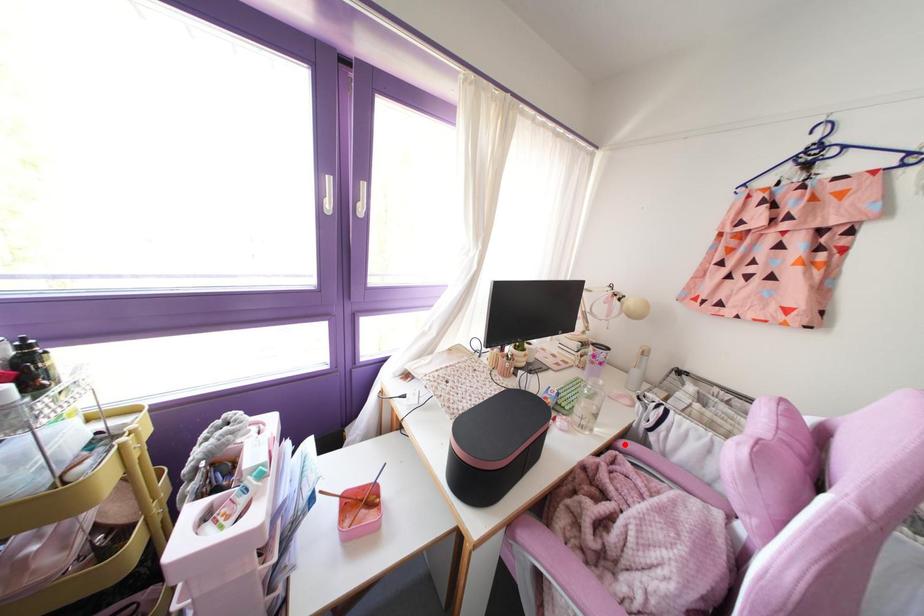
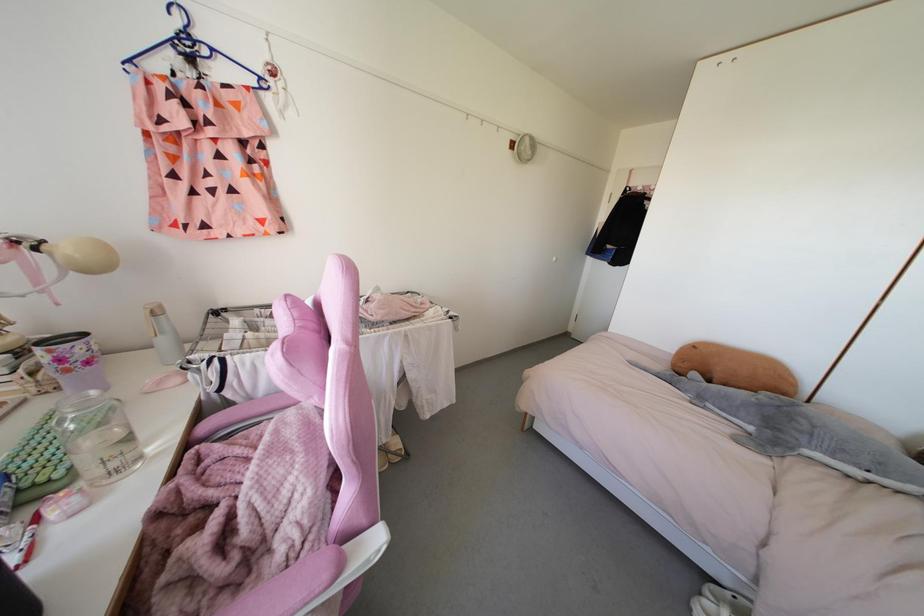
Where in the second image is the point corresponding to the highlighted location from the first image?

(204, 426)